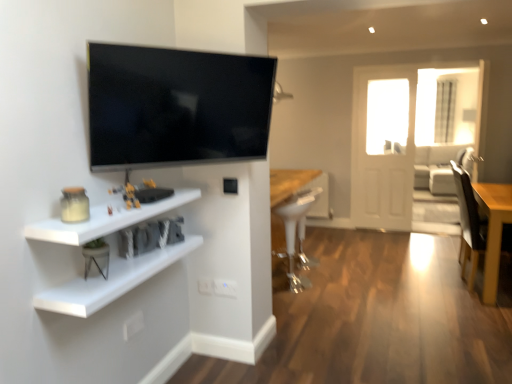
Question: Considering the positions of matte black tv at upper left and white glossy stool at center in the image, is matte black tv at upper left bigger or smaller than white glossy stool at center?

Choices:
 (A) small
 (B) big

Answer: (A)

Question: Considering the positions of matte black tv at upper left and white glossy stool at center in the image, is matte black tv at upper left wider or thinner than white glossy stool at center?

Choices:
 (A) wide
 (B) thin

Answer: (B)

Question: Estimate the real-world distances between objects in this image. Which object is closer to the matte black tv at upper left?

Choices:
 (A) light brown wooden table at right
 (B) white matte shelf at lower left, which is counted as the 1th shelf, starting from the top
 (C) light gray fabric couch at right
 (D) white matte shelf at lower left, which ranks as the 2th shelf in top-to-bottom order
 (E) white glossy stool at center

Answer: (B)

Question: Which is nearer to the white glossy stool at center?

Choices:
 (A) white matte shelf at lower left, which is counted as the 1th shelf, starting from the top
 (B) matte black tv at upper left
 (C) light gray fabric couch at right
 (D) wooden swivel chair at right
 (E) light brown wooden table at right

Answer: (D)